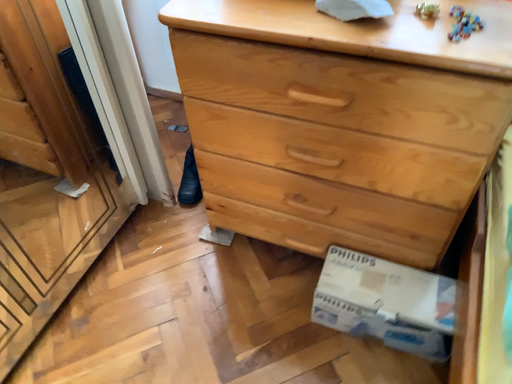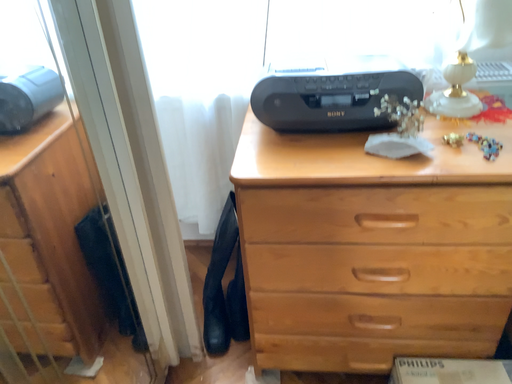
Question: How did the camera likely rotate when shooting the video?

Choices:
 (A) rotated downward
 (B) rotated upward

Answer: (B)